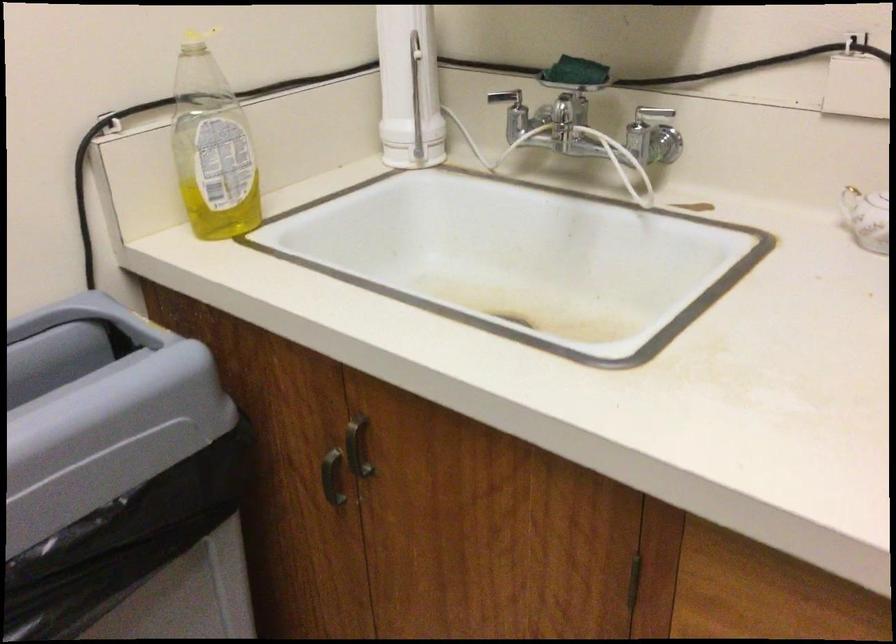
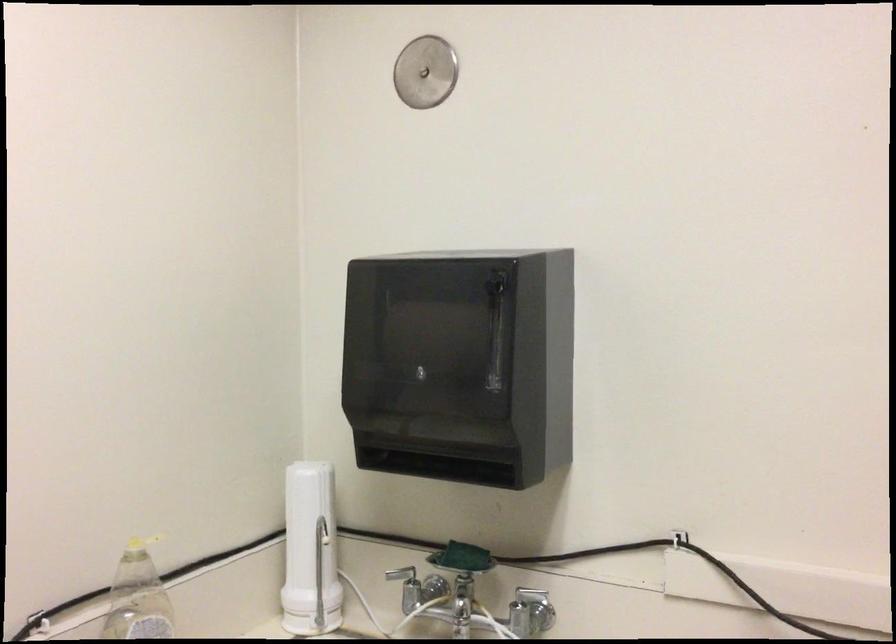
What movement of the cameraman would produce the second image?

The cameraman moved toward left, backward.